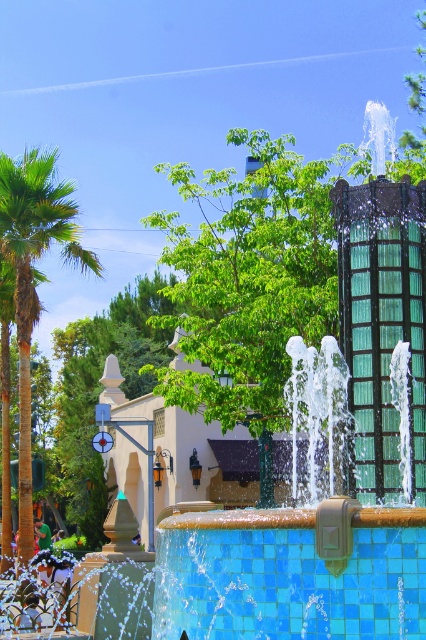
You are standing in the outdoor scene looking at the fountain and the green glass structure. There are two points marked in the image. The first point is at coordinates point (261, 540) and the second is at point (80, 246). Which point is closer to your current position?

Point (261, 540) is closer to the camera than point (80, 246), so the first point is closer to your current position.

You are standing at the fountain in the foreground and want to walk to the blue mosaic tile swimming pool at center. Which direction should you head to reach it?

The blue mosaic tile swimming pool at center is located at point (288, 577), so you should head towards the center of the image to reach it.